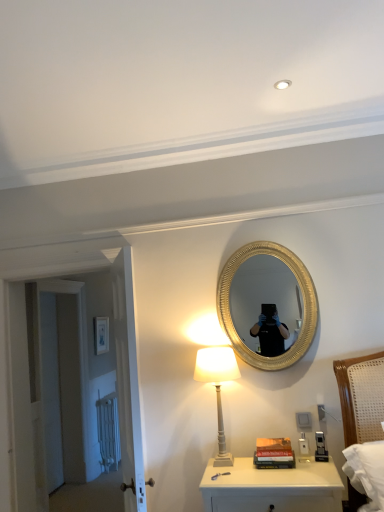
Question: Is white wooden door at left, which appears as the 2th door when viewed from the back, spatially inside white glossy nightstand at lower center, or outside of it?

Choices:
 (A) inside
 (B) outside

Answer: (B)

Question: From the image's perspective, is white wooden door at left, which appears as the 2th door when viewed from the back, above or below white glossy nightstand at lower center?

Choices:
 (A) above
 (B) below

Answer: (A)

Question: Based on their relative distances, which object is farther from the white wooden door at left, which appears as the 2th door when viewed from the back?

Choices:
 (A) hardcover books at center
 (B) white matte door at left, the second door from the front
 (C) white painted wood table lamp at lower center
 (D) matte white picture frame at upper left
 (E) white glossy nightstand at lower center

Answer: (A)

Question: Estimate the real-world distances between objects in this image. Which object is farther from the matte white picture frame at upper left?

Choices:
 (A) hardcover books at center
 (B) white painted wood table lamp at lower center
 (C) white glossy nightstand at lower center
 (D) white wooden door at left, which appears as the 2th door when viewed from the back
 (E) white matte door at left, the second door from the front

Answer: (C)